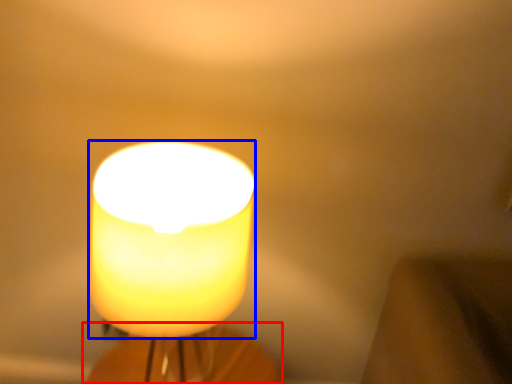
Question: Which of the following is the closest to the observer, candle holder (highlighted by a red box) or candle (highlighted by a blue box)?

Choices:
 (A) candle holder
 (B) candle

Answer: (B)